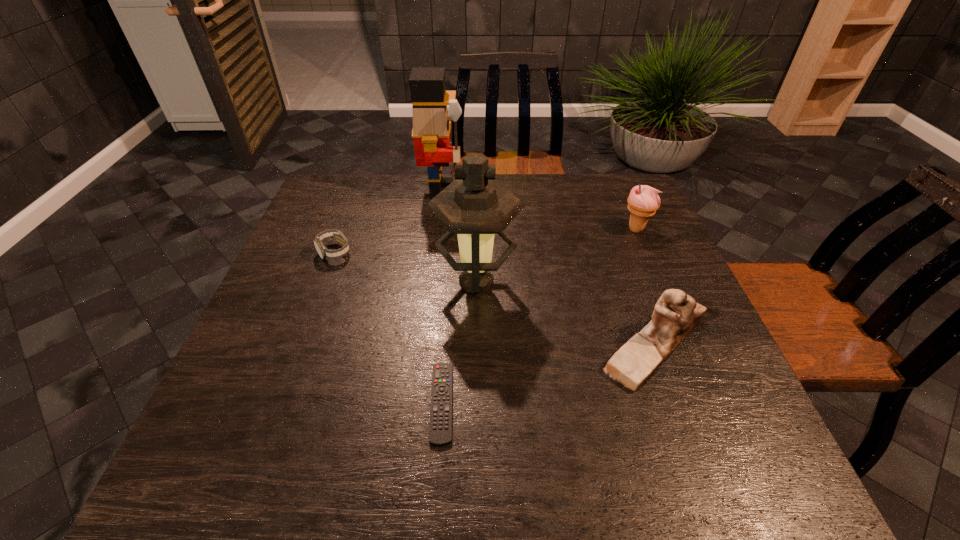
Find the location of a particular element. The image size is (960, 540). free space located on the front-facing side of the figurine is located at coordinates (481, 345).

The image size is (960, 540). I want to click on free space located on the front-facing side of the figurine, so click(486, 345).

You are a GUI agent. You are given a task and a screenshot of the screen. Output one action in this format:
    pyautogui.click(x=<x>, y=<y>)
    Task: Click on the blank space located on the front-facing side of the figurine
    The height and width of the screenshot is (540, 960).
    Given the screenshot: What is the action you would take?
    [440, 345]

The image size is (960, 540). I want to click on free space located 0.160m on the face of the fifth tallest object, so click(x=313, y=309).

The width and height of the screenshot is (960, 540). Identify the location of free region located 0.220m on the right of the remote control. (568, 403).

Identify the location of object present at the far edge. (431, 129).

Locate an element on the screen. Image resolution: width=960 pixels, height=540 pixels. object present at the near edge is located at coordinates (440, 429).

Locate an element on the screen. The height and width of the screenshot is (540, 960). object that is at the left edge is located at coordinates (324, 253).

At what (x,y) coordinates should I click in order to perform the action: click on icecream located in the right edge section of the desktop. Please return your answer as a coordinate pair (x, y). The width and height of the screenshot is (960, 540). Looking at the image, I should click on (643, 201).

Identify the location of figurine present at the right edge. (676, 313).